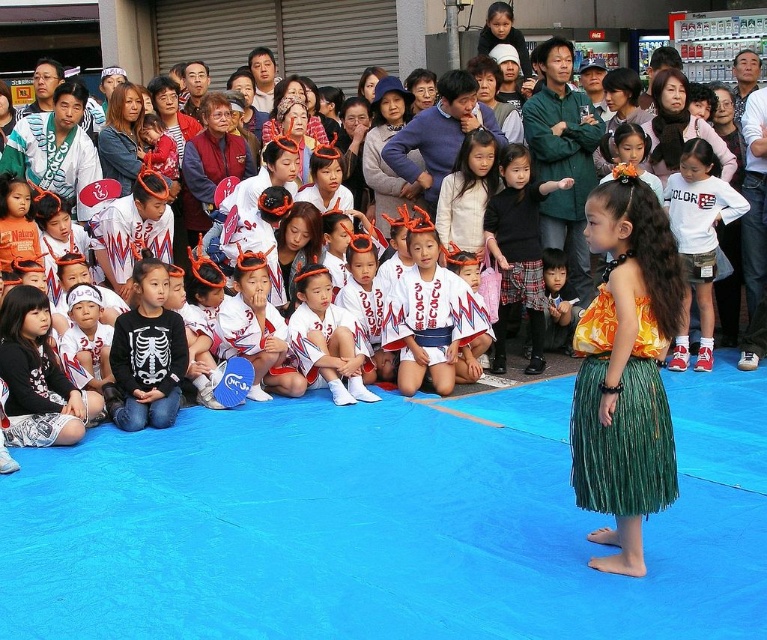
Can you confirm if white cotton clothing at upper center is shorter than white cotton shirt at center?

No.

Does point (239, 189) lie in front of point (703, 332)?

No, (239, 189) is further to viewer.

Is point (107, 273) positioned before point (667, 184)?

Yes, it is in front of point (667, 184).

Where is `white cotton clothing at upper center`? white cotton clothing at upper center is located at coordinates coord(25,134).

Who is more distant from viewer, (574, 396) or (686, 244)?

Point (686, 244)

Is green grass skirt at lower right to the left of white cotton shirt at center from the viewer's perspective?

Indeed, green grass skirt at lower right is positioned on the left side of white cotton shirt at center.

Who is more distant from viewer, (640, 356) or (698, 234)?

Point (698, 234)

Locate an element on the screen. Image resolution: width=767 pixels, height=640 pixels. green grass skirt at lower right is located at coordinates (621, 419).

Who is taller, green grass skirt at lower right or white cotton clothing at upper center?

white cotton clothing at upper center

Can you confirm if green grass skirt at lower right is smaller than white cotton clothing at upper center?

Correct, green grass skirt at lower right occupies less space than white cotton clothing at upper center.

Is point (659, 509) positioned in front of point (377, 176)?

Yes.

This screenshot has height=640, width=767. In order to click on green grass skirt at lower right in this screenshot , I will do `click(621, 419)`.